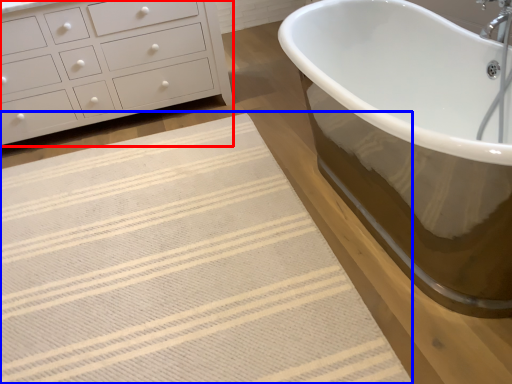
Question: Among these objects, which one is nearest to the camera, chest of drawers (highlighted by a red box) or bath mat (highlighted by a blue box)?

Choices:
 (A) chest of drawers
 (B) bath mat

Answer: (B)